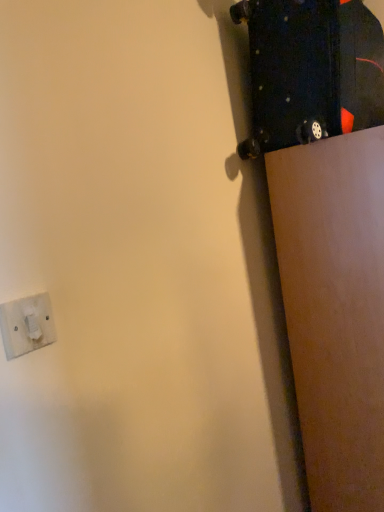
Question: From a real-world perspective, does white plastic socket at lower left stand above black matte skateboard at upper right?

Choices:
 (A) no
 (B) yes

Answer: (A)

Question: Is white plastic socket at lower left facing towards black matte skateboard at upper right?

Choices:
 (A) yes
 (B) no

Answer: (B)

Question: From a real-world perspective, is white plastic socket at lower left beneath black matte skateboard at upper right?

Choices:
 (A) no
 (B) yes

Answer: (B)

Question: From the image's perspective, does white plastic socket at lower left appear higher than black matte skateboard at upper right?

Choices:
 (A) no
 (B) yes

Answer: (A)

Question: From the image's perspective, is white plastic socket at lower left beneath black matte skateboard at upper right?

Choices:
 (A) yes
 (B) no

Answer: (A)

Question: Is the position of white plastic socket at lower left more distant than that of black matte skateboard at upper right?

Choices:
 (A) yes
 (B) no

Answer: (B)

Question: Is black matte skateboard at upper right closer to camera compared to white plastic socket at lower left?

Choices:
 (A) yes
 (B) no

Answer: (B)

Question: From the image's perspective, is black matte skateboard at upper right on top of white plastic socket at lower left?

Choices:
 (A) yes
 (B) no

Answer: (A)

Question: From the image's perspective, is black matte skateboard at upper right located beneath white plastic socket at lower left?

Choices:
 (A) no
 (B) yes

Answer: (A)

Question: Does black matte skateboard at upper right contain white plastic socket at lower left?

Choices:
 (A) yes
 (B) no

Answer: (B)

Question: Is black matte skateboard at upper right bigger than white plastic socket at lower left?

Choices:
 (A) yes
 (B) no

Answer: (A)

Question: Can you confirm if black matte skateboard at upper right is positioned to the right of white plastic socket at lower left?

Choices:
 (A) no
 (B) yes

Answer: (B)

Question: Considering the relative positions of black matte skateboard at upper right and white plastic socket at lower left in the image provided, is black matte skateboard at upper right to the left or to the right of white plastic socket at lower left?

Choices:
 (A) left
 (B) right

Answer: (B)